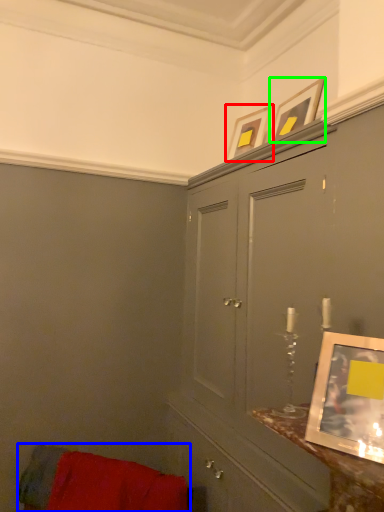
Question: Which object is positioned closest to picture frame (highlighted by a red box)? Select from furniture (highlighted by a blue box) and picture frame (highlighted by a green box).

Choices:
 (A) furniture
 (B) picture frame

Answer: (B)